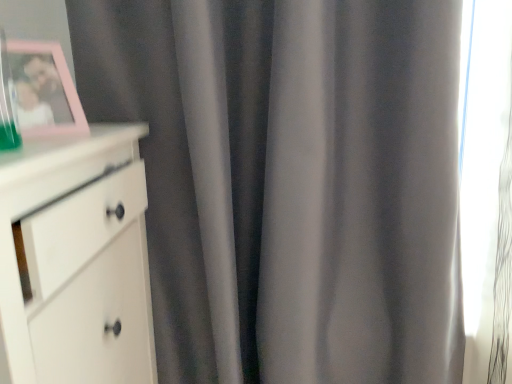
The width and height of the screenshot is (512, 384). In order to click on pink plastic picture frame at upper left in this screenshot , I will do `click(44, 90)`.

The height and width of the screenshot is (384, 512). Describe the element at coordinates (44, 90) in the screenshot. I see `pink plastic picture frame at upper left` at that location.

The height and width of the screenshot is (384, 512). Find the location of `white matte chest of drawers at left`. white matte chest of drawers at left is located at coordinates (77, 260).

The height and width of the screenshot is (384, 512). What do you see at coordinates (77, 260) in the screenshot?
I see `white matte chest of drawers at left` at bounding box center [77, 260].

Find the location of a particular element. Image resolution: width=512 pixels, height=384 pixels. pink plastic picture frame at upper left is located at coordinates (44, 90).

Is white matte chest of drawers at left at the right side of pink plastic picture frame at upper left?

In fact, white matte chest of drawers at left is to the left of pink plastic picture frame at upper left.

Which object is closer to the camera taking this photo, white matte chest of drawers at left or pink plastic picture frame at upper left?

white matte chest of drawers at left.

Considering the positions of point (134, 281) and point (72, 82), is point (134, 281) closer or farther from the camera than point (72, 82)?

Point (134, 281).

Consider the image. From the image's perspective, is white matte chest of drawers at left below pink plastic picture frame at upper left?

Yes, from the image's perspective, white matte chest of drawers at left is below pink plastic picture frame at upper left.

From a real-world perspective, which object rests below the other?

From a 3D spatial view, white matte chest of drawers at left is below.

Can you confirm if white matte chest of drawers at left is wider than pink plastic picture frame at upper left?

Yes.

Does white matte chest of drawers at left have a lesser height compared to pink plastic picture frame at upper left?

No, white matte chest of drawers at left is not shorter than pink plastic picture frame at upper left.

Between white matte chest of drawers at left and pink plastic picture frame at upper left, which one has larger size?

Bigger between the two is white matte chest of drawers at left.

Is pink plastic picture frame at upper left surrounded by white matte chest of drawers at left?

No, pink plastic picture frame at upper left is located outside of white matte chest of drawers at left.

Would you say white matte chest of drawers at left is a long distance from pink plastic picture frame at upper left?

No.

Could you tell me if white matte chest of drawers at left is facing pink plastic picture frame at upper left?

No.

How different are the orientations of white matte chest of drawers at left and pink plastic picture frame at upper left in degrees?

white matte chest of drawers at left and pink plastic picture frame at upper left are facing 42.3 degrees away from each other.

How far apart are white matte chest of drawers at left and pink plastic picture frame at upper left?

white matte chest of drawers at left is 20.25 centimeters away from pink plastic picture frame at upper left.

Locate an element on the screen. The height and width of the screenshot is (384, 512). picture frame above the white matte chest of drawers at left (from the image's perspective) is located at coordinates (44, 90).

Between pink plastic picture frame at upper left and white matte chest of drawers at left, which one appears on the right side from the viewer's perspective?

Positioned to the right is pink plastic picture frame at upper left.

Is pink plastic picture frame at upper left behind white matte chest of drawers at left?

Yes.

Which point is more distant from viewer, (52, 116) or (90, 267)?

The point (52, 116) is behind.

From the image's perspective, between pink plastic picture frame at upper left and white matte chest of drawers at left, which one is located above?

pink plastic picture frame at upper left.

From a real-world perspective, between pink plastic picture frame at upper left and white matte chest of drawers at left, who is vertically higher?

In real-world perspective, pink plastic picture frame at upper left is above.

Between pink plastic picture frame at upper left and white matte chest of drawers at left, which one has smaller width?

Thinner between the two is pink plastic picture frame at upper left.

Can you confirm if pink plastic picture frame at upper left is shorter than white matte chest of drawers at left?

Yes.

Which of these two, pink plastic picture frame at upper left or white matte chest of drawers at left, is smaller?

pink plastic picture frame at upper left.

Choose the correct answer: Is pink plastic picture frame at upper left inside white matte chest of drawers at left or outside it?

pink plastic picture frame at upper left cannot be found inside white matte chest of drawers at left.

Is pink plastic picture frame at upper left not close to white matte chest of drawers at left?

They are positioned close to each other.

Is pink plastic picture frame at upper left turned away from white matte chest of drawers at left?

No, pink plastic picture frame at upper left's orientation is not away from white matte chest of drawers at left.

Measure the distance from pink plastic picture frame at upper left to white matte chest of drawers at left.

pink plastic picture frame at upper left and white matte chest of drawers at left are 20.25 centimeters apart.

The width and height of the screenshot is (512, 384). I want to click on chest of drawers on the left side of pink plastic picture frame at upper left, so click(x=77, y=260).

In order to click on the chest of drawers below the pink plastic picture frame at upper left (from a real-world perspective) in this screenshot , I will do `click(77, 260)`.

The width and height of the screenshot is (512, 384). I want to click on picture frame on the right side of white matte chest of drawers at left, so click(44, 90).